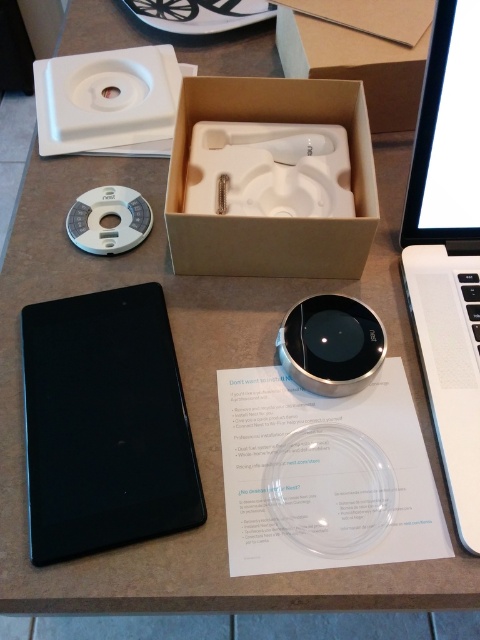
Question: Which object is closer to the camera taking this photo?

Choices:
 (A) black matte tablet at lower left
 (B) brown cardboard box at center
 (C) transparent plastic cd at center
 (D) white plastic cd at upper left

Answer: (A)

Question: Observing the image, what is the correct spatial positioning of brown cardboard box at upper center in reference to white plastic cd at upper left?

Choices:
 (A) below
 (B) above

Answer: (B)

Question: Which of the following is the farthest from the observer?

Choices:
 (A) brown cardboard box at center
 (B) black matte tablet at lower left
 (C) brown cardboard box at upper center
 (D) transparent plastic cd at center

Answer: (C)

Question: In this image, where is white matte laptop at right located relative to transparent plastic cd at center?

Choices:
 (A) left
 (B) right

Answer: (B)

Question: Is black matte tablet at lower left to the left of brown cardboard box at upper center from the viewer's perspective?

Choices:
 (A) no
 (B) yes

Answer: (B)

Question: Estimate the real-world distances between objects in this image. Which object is closer to the white matte laptop at right?

Choices:
 (A) white plastic cd at upper left
 (B) transparent plastic cd at center
 (C) brown cardboard box at center

Answer: (C)